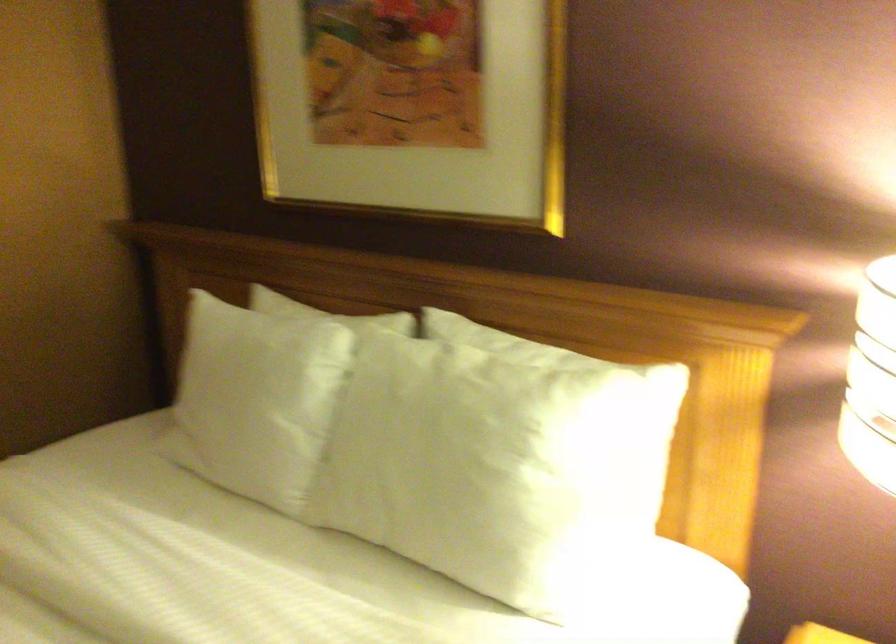
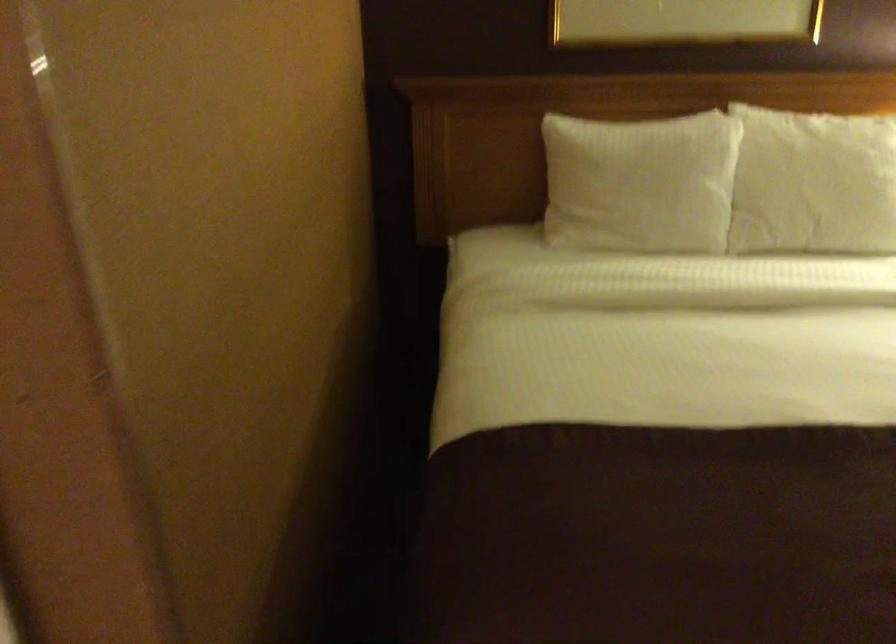
Question: In a continuous first-person perspective shot, in which direction is the camera moving?

Choices:
 (A) Left
 (B) Right
 (C) Forward
 (D) Backward

Answer: (A)